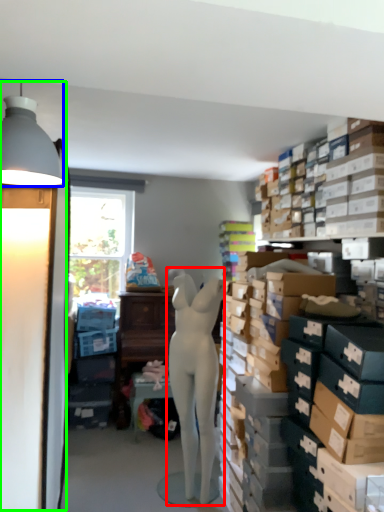
Question: Estimate the real-world distances between objects in this image. Which object is closer to person (highlighted by a red box), lamp (highlighted by a blue box) or table lamp (highlighted by a green box)?

Choices:
 (A) lamp
 (B) table lamp

Answer: (B)